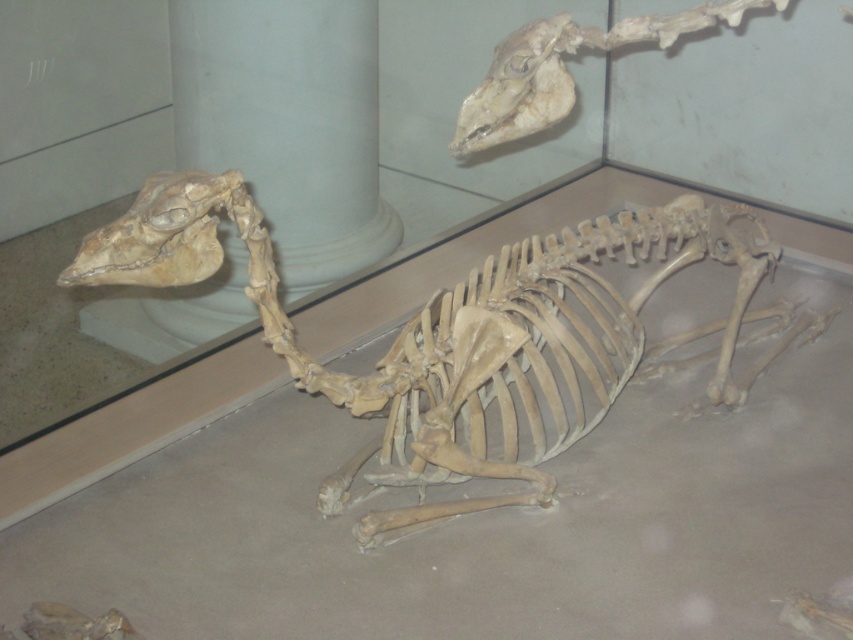
Question: Among these points, which one is farthest from the camera?

Choices:
 (A) (476, 113)
 (B) (445, 385)
 (C) (325, 120)
 (D) (96, 253)

Answer: (C)

Question: Which point is closer to the camera?

Choices:
 (A) (552, 120)
 (B) (270, 163)
 (C) (729, 349)

Answer: (A)

Question: Which point is closer to the camera taking this photo?

Choices:
 (A) [x=544, y=397]
 (B) [x=564, y=112]
 (C) [x=207, y=209]
 (D) [x=187, y=125]

Answer: (C)

Question: Is brown bone skull at upper left to the right of light brown bone at upper center from the viewer's perspective?

Choices:
 (A) no
 (B) yes

Answer: (A)

Question: Is white marble pillar at upper center above light brown bone at upper center?

Choices:
 (A) no
 (B) yes

Answer: (A)

Question: Does bone-like skeleton at center appear under brown bone skull at upper left?

Choices:
 (A) yes
 (B) no

Answer: (A)